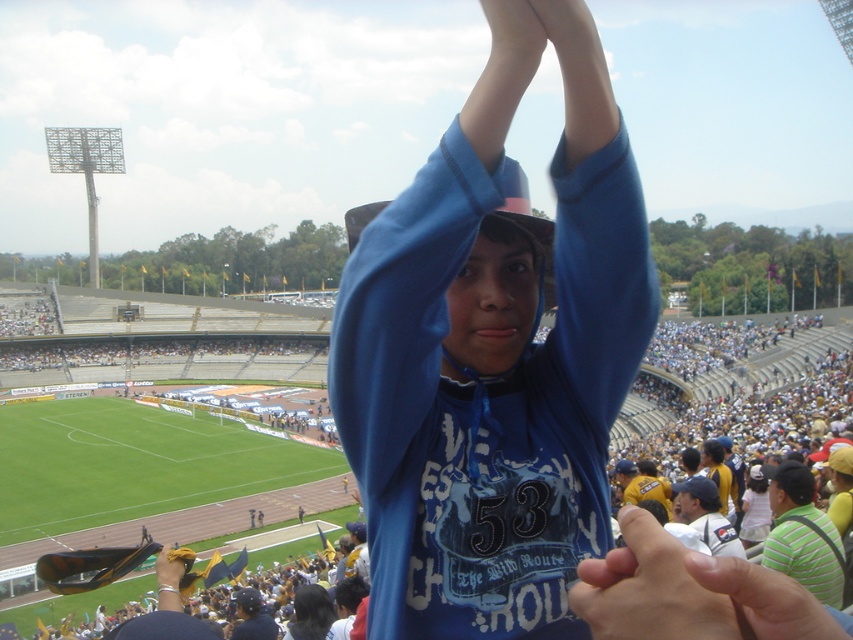
Does green striped shirt at center come in front of white jersey at center?

Yes.

What do you see at coordinates (802, 536) in the screenshot?
I see `green striped shirt at center` at bounding box center [802, 536].

What do you see at coordinates (802, 536) in the screenshot? The width and height of the screenshot is (853, 640). I see `green striped shirt at center` at bounding box center [802, 536].

This screenshot has height=640, width=853. Find the location of `green striped shirt at center`. green striped shirt at center is located at coordinates (802, 536).

Who is positioned more to the right, blue fleece hoodie at center or smooth yellow glove at center?

blue fleece hoodie at center

Can you confirm if blue fleece hoodie at center is positioned to the left of smooth yellow glove at center?

Incorrect, blue fleece hoodie at center is not on the left side of smooth yellow glove at center.

In the scene shown: Who is more distant from viewer, (506, 620) or (178, 568)?

The point (178, 568) is more distant.

Where is `blue fleece hoodie at center`? This screenshot has height=640, width=853. blue fleece hoodie at center is located at coordinates (494, 353).

Between blue fleece hoodie at center and smooth skin hand at center, which one appears on the right side from the viewer's perspective?

Positioned to the right is smooth skin hand at center.

Does blue fleece hoodie at center have a greater width compared to smooth skin hand at center?

Yes, blue fleece hoodie at center is wider than smooth skin hand at center.

The height and width of the screenshot is (640, 853). Find the location of `blue fleece hoodie at center`. blue fleece hoodie at center is located at coordinates (494, 353).